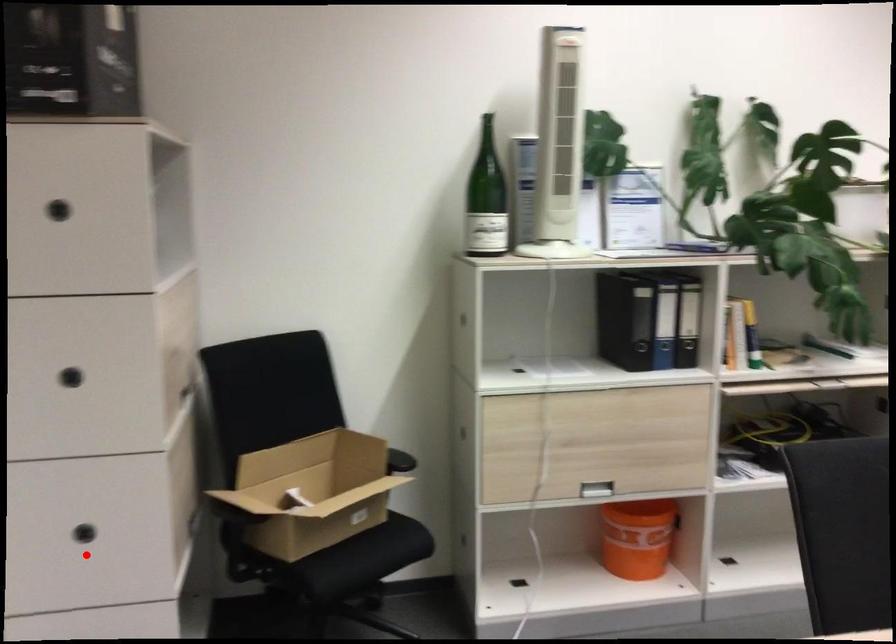
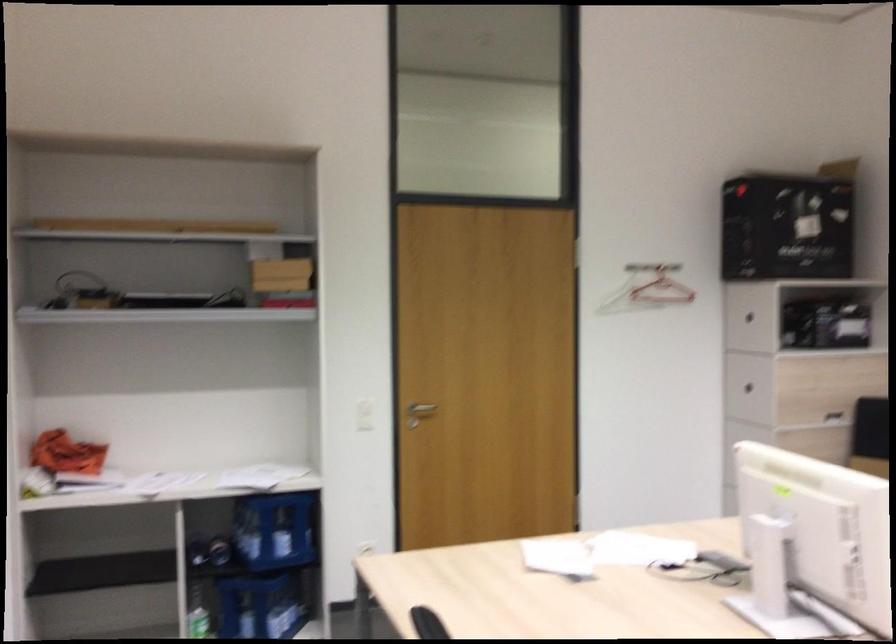
Question: I am providing you with two images of the same scene from different viewpoints. A red point is marked on the first image. Can you still see the location of the red point in image 2?

Choices:
 (A) Yes
 (B) No

Answer: (B)